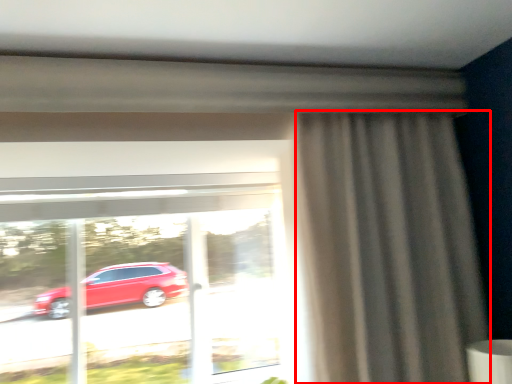
Question: From the image, what is the correct spatial relationship of curtain (annotated by the red box) in relation to window?

Choices:
 (A) left
 (B) right

Answer: (B)